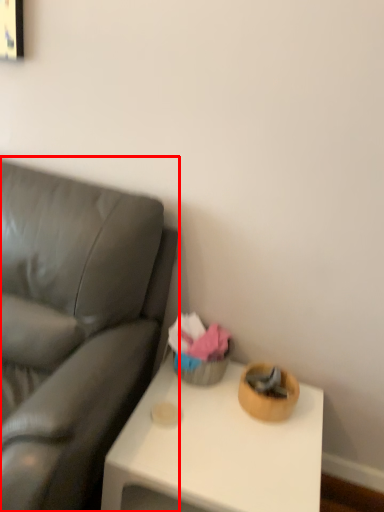
Question: In this image, where is studio couch (annotated by the red box) located relative to table?

Choices:
 (A) left
 (B) right

Answer: (A)